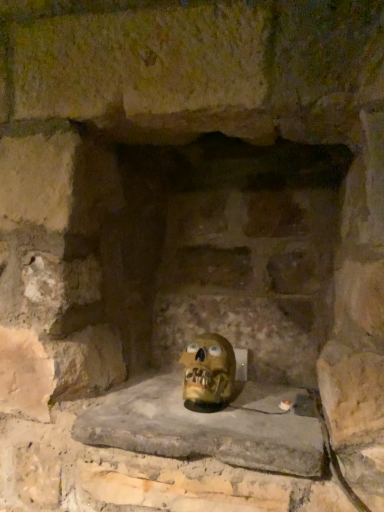
You are a GUI agent. You are given a task and a screenshot of the screen. Output one action in this format:
    pyautogui.click(x=<x>, y=<y>)
    Task: Click on the vacant area located to the right-hand side of matte yellow skull at center
    
    Given the screenshot: What is the action you would take?
    pyautogui.click(x=277, y=407)